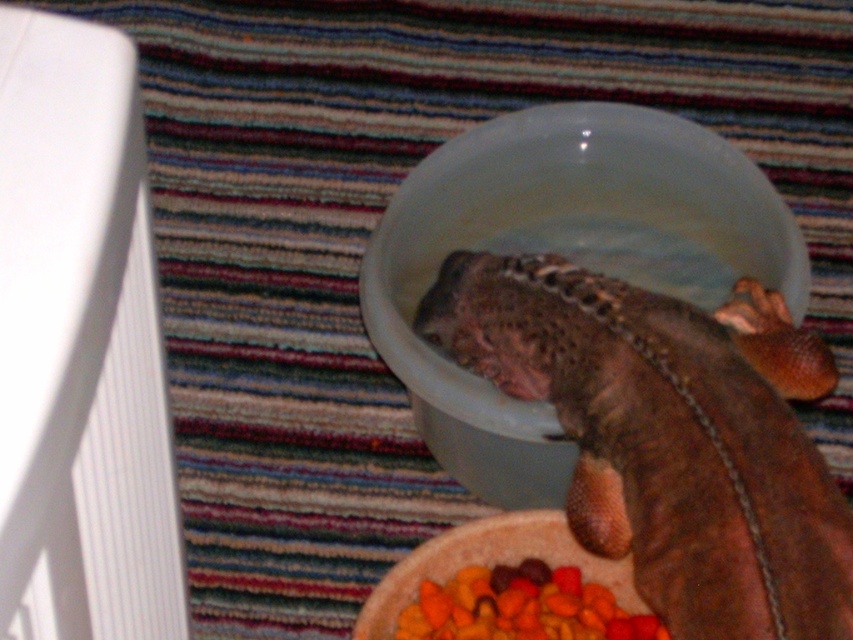
Question: Considering the real-world distances, which object is farthest from the brown scaly lizard at center?

Choices:
 (A) translucent plastic bowl at center
 (B) carrot-like pieces at lower center

Answer: (B)

Question: Which point appears closest to the camera in this image?

Choices:
 (A) (596, 205)
 (B) (706, 579)
 (C) (486, 576)

Answer: (B)

Question: Is brown scaly lizard at center above translucent plastic bowl at center?

Choices:
 (A) no
 (B) yes

Answer: (A)

Question: Does translucent plastic bowl at center appear on the right side of carrot-like pieces at lower center?

Choices:
 (A) yes
 (B) no

Answer: (A)

Question: Does brown scaly lizard at center appear on the left side of translucent plastic bowl at center?

Choices:
 (A) yes
 (B) no

Answer: (B)

Question: Which point appears closest to the camera in this image?

Choices:
 (A) (753, 369)
 (B) (421, 371)

Answer: (A)